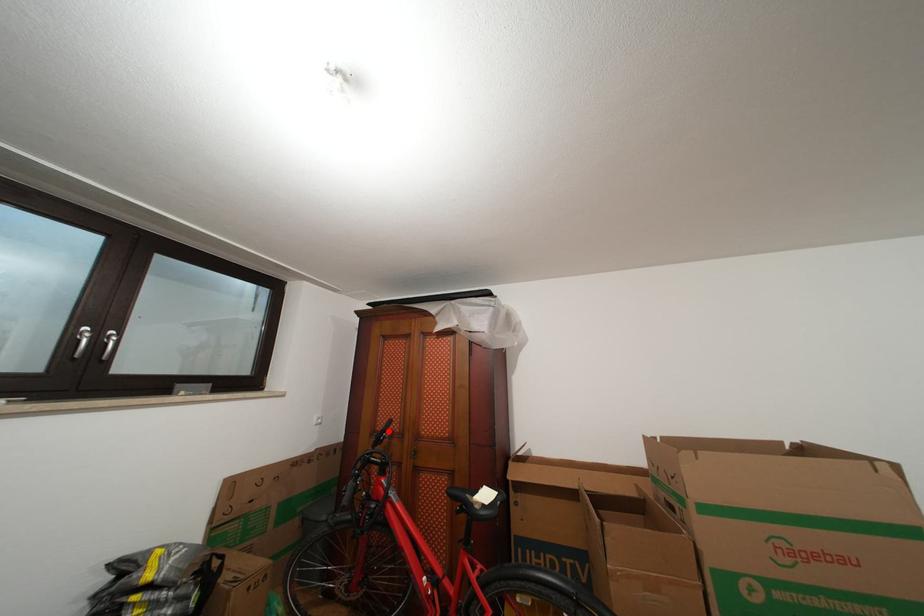
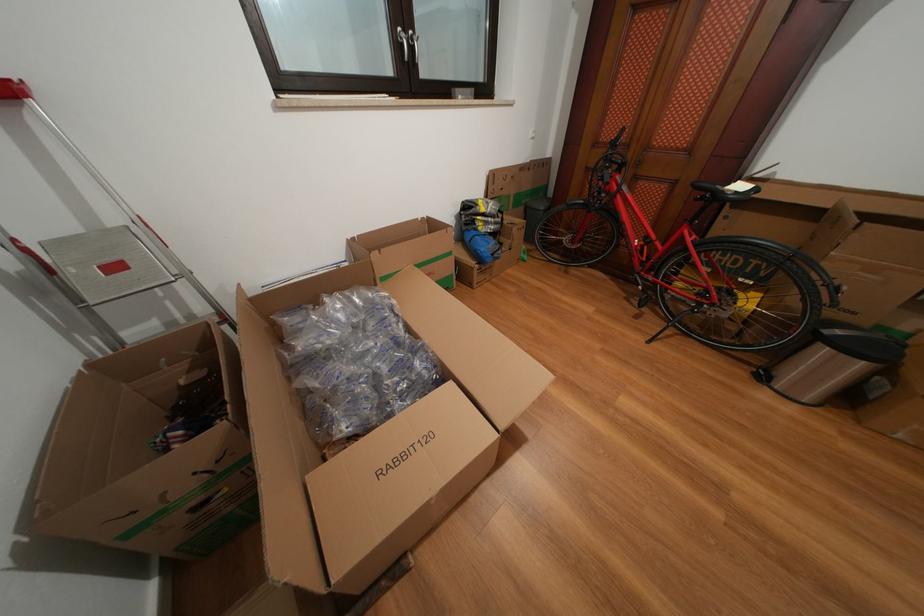
Question: I am providing you with two images of the same scene from different viewpoints. In image1, a red point is highlighted. Considering the same 3D point in image2, which of the following is correct?

Choices:
 (A) It is closer
 (B) It is farther

Answer: (A)